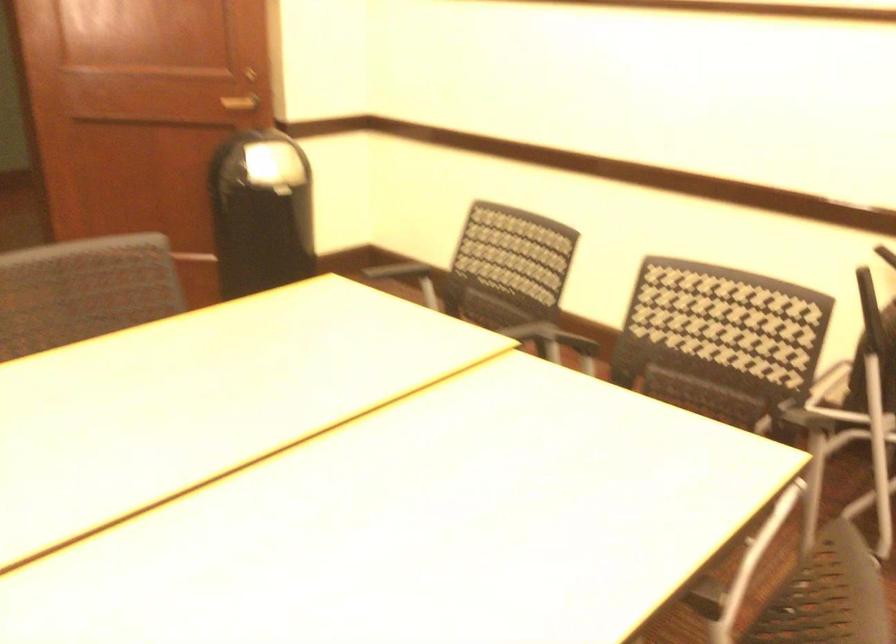
What do you see at coordinates (240, 102) in the screenshot? I see `a brown door handle` at bounding box center [240, 102].